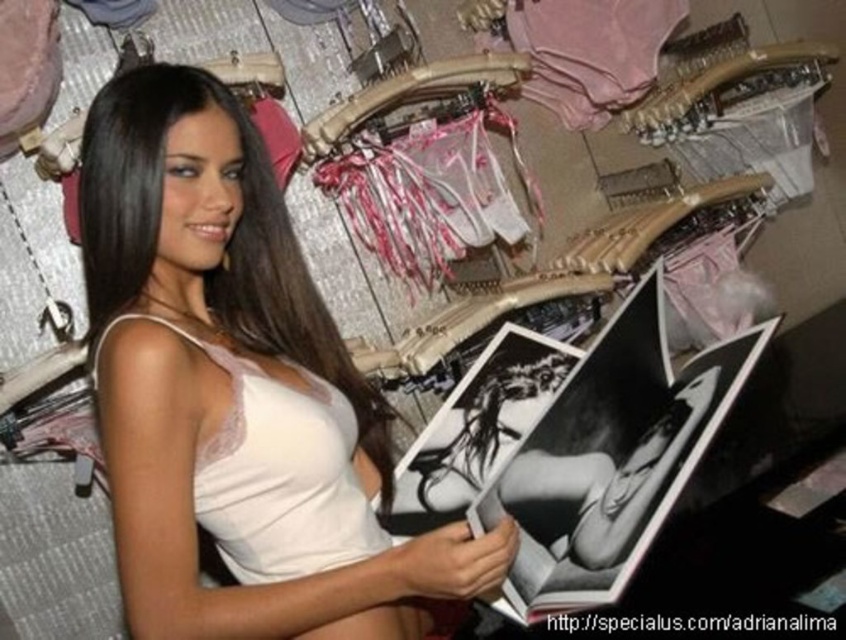
Between white satin bra at center and white lace bikini top at center, which one is positioned lower?

white lace bikini top at center is lower down.

What do you see at coordinates (224, 369) in the screenshot?
I see `white satin bra at center` at bounding box center [224, 369].

The height and width of the screenshot is (640, 846). I want to click on white satin bra at center, so click(x=224, y=369).